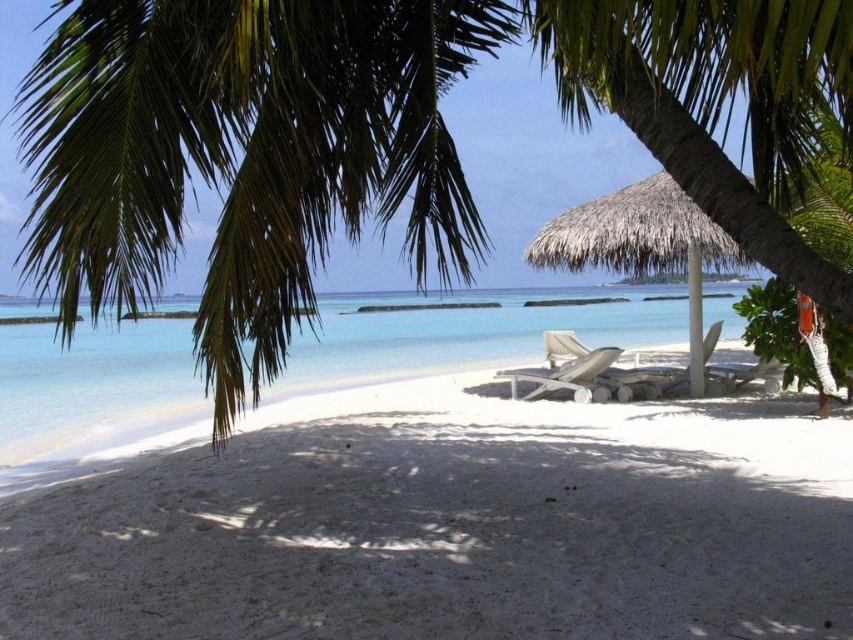
Question: Is clear blue water at center positioned at the back of white plastic lounge chair at center?

Choices:
 (A) no
 (B) yes

Answer: (A)

Question: Can you confirm if white sandy beach at center is thinner than green leafy palm tree at upper left?

Choices:
 (A) no
 (B) yes

Answer: (A)

Question: Among these points, which one is farthest from the camera?

Choices:
 (A) (570, 262)
 (B) (526, 310)
 (C) (766, 134)
 (D) (561, 371)

Answer: (B)

Question: Among these points, which one is farthest from the camera?

Choices:
 (A) (637, 131)
 (B) (86, 161)
 (C) (4, 563)

Answer: (C)

Question: Can you confirm if clear blue water at center is wider than thatched straw umbrella at center?

Choices:
 (A) yes
 (B) no

Answer: (A)

Question: Which point appears closest to the camera in this image?

Choices:
 (A) (115, 432)
 (B) (712, 56)

Answer: (B)